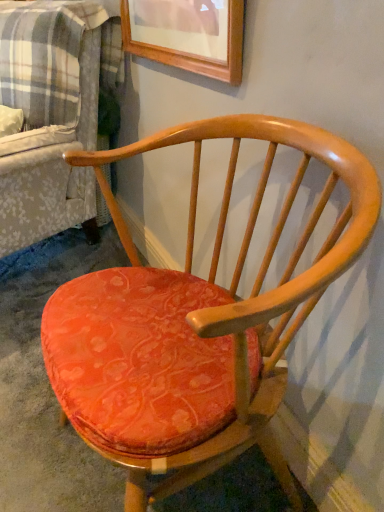
Question: Choose the correct answer: Is plaid fabric couch at left inside velvet orange cushion at center or outside it?

Choices:
 (A) inside
 (B) outside

Answer: (B)

Question: From a real-world perspective, is plaid fabric couch at left positioned above or below velvet orange cushion at center?

Choices:
 (A) below
 (B) above

Answer: (B)

Question: Which object is the closest to the plaid fabric couch at left?

Choices:
 (A) matte orange cushioned chair at center
 (B) velvet orange cushion at center

Answer: (A)

Question: Which is nearer to the plaid fabric couch at left?

Choices:
 (A) velvet orange cushion at center
 (B) matte orange cushioned chair at center

Answer: (B)